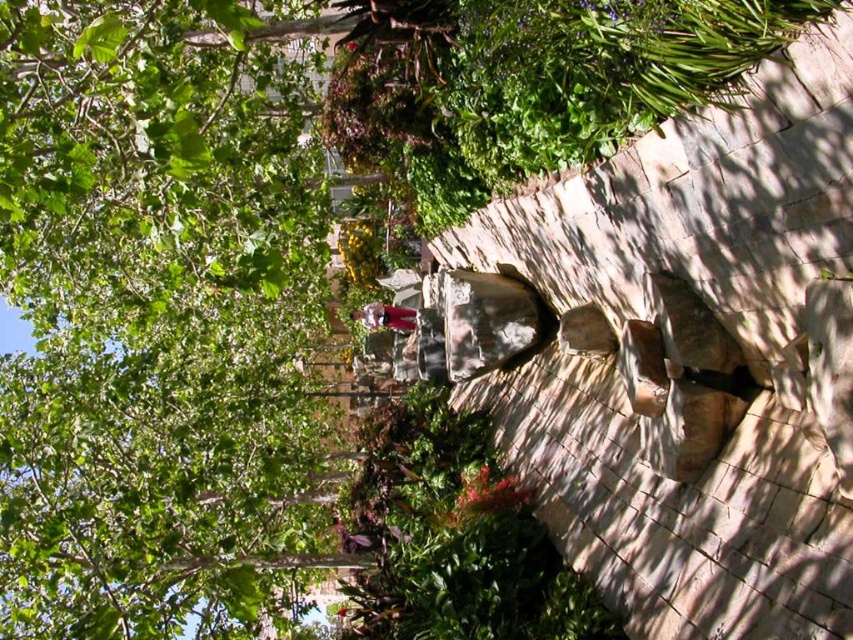
You are a fashion designer observing the serene garden scene. You notice the natural stone rock face at center and the matte purple dress at center. Which object occupies more horizontal space in the image?

The matte purple dress at center occupies more horizontal space than the natural stone rock face at center because the natural stone rock face at center has a lesser width compared to the matte purple dress at center.

You are a gardener planning to plant a new flower bed between the green leafy tree at upper left and the natural stone rock face at center. Based on their positions, which object should you avoid placing flowers too close to in order to maintain proper drainage?

You should avoid placing flowers too close to the natural stone rock face at center because the green leafy tree at upper left is positioned over it, which means water from the tree might drain towards the rock face, potentially causing waterlogging around the flowers.